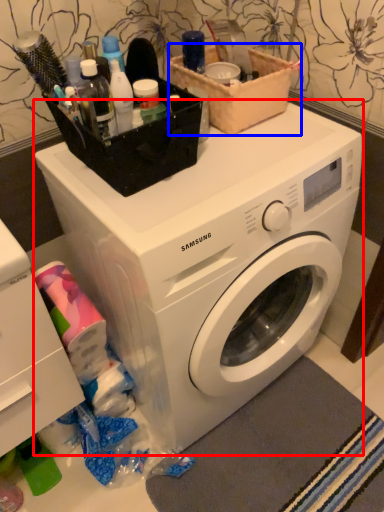
Question: Which of the following is the farthest to the observer, washing machine (highlighted by a red box) or basket (highlighted by a blue box)?

Choices:
 (A) washing machine
 (B) basket

Answer: (B)